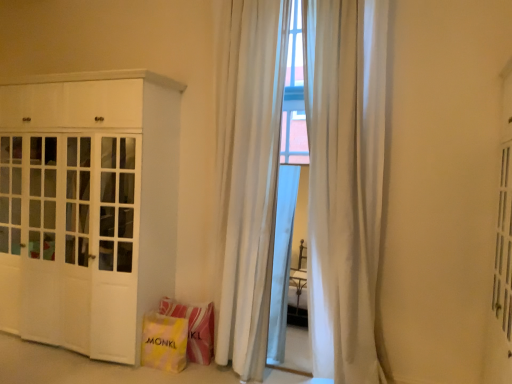
Question: From a real-world perspective, does yellow fabric shopping bag at lower left, positioned as the 2th shopping bag in back-to-front order, sit lower than yellow fabric shopping bag at lower center, which appears as the second shopping bag when viewed from the front?

Choices:
 (A) no
 (B) yes

Answer: (B)

Question: Is yellow fabric shopping bag at lower left, positioned as the 2th shopping bag in back-to-front order, positioned behind yellow fabric shopping bag at lower center, the 1th shopping bag from the back?

Choices:
 (A) yes
 (B) no

Answer: (B)

Question: From a real-world perspective, does yellow fabric shopping bag at lower left, positioned as the 2th shopping bag in back-to-front order, stand above yellow fabric shopping bag at lower center, which appears as the second shopping bag when viewed from the front?

Choices:
 (A) yes
 (B) no

Answer: (B)

Question: Can you confirm if yellow fabric shopping bag at lower left, positioned as the 2th shopping bag in back-to-front order, is taller than yellow fabric shopping bag at lower center, which appears as the second shopping bag when viewed from the front?

Choices:
 (A) no
 (B) yes

Answer: (A)

Question: Can yellow fabric shopping bag at lower center, which appears as the second shopping bag when viewed from the front, be found inside yellow fabric shopping bag at lower left, placed as the 1th shopping bag when sorted from front to back?

Choices:
 (A) yes
 (B) no

Answer: (B)

Question: From the image's perspective, relative to yellow fabric shopping bag at lower center, the 1th shopping bag from the back, is white matte cabinet at left above or below?

Choices:
 (A) below
 (B) above

Answer: (B)

Question: In the image, is white matte cabinet at left on the left side or the right side of yellow fabric shopping bag at lower center, the 1th shopping bag from the back?

Choices:
 (A) left
 (B) right

Answer: (A)

Question: Is point (75, 206) closer or farther from the camera than point (210, 306)?

Choices:
 (A) closer
 (B) farther

Answer: (B)

Question: Is white matte cabinet at left in front of or behind yellow fabric shopping bag at lower center, which appears as the second shopping bag when viewed from the front, in the image?

Choices:
 (A) behind
 (B) front

Answer: (B)

Question: In terms of width, does yellow fabric shopping bag at lower left, positioned as the 2th shopping bag in back-to-front order, look wider or thinner when compared to white matte cabinet at left?

Choices:
 (A) thin
 (B) wide

Answer: (A)

Question: In the image, is yellow fabric shopping bag at lower left, placed as the 1th shopping bag when sorted from front to back, on the left side or the right side of white matte cabinet at left?

Choices:
 (A) left
 (B) right

Answer: (B)

Question: From a real-world perspective, relative to white matte cabinet at left, is yellow fabric shopping bag at lower left, positioned as the 2th shopping bag in back-to-front order, vertically above or below?

Choices:
 (A) below
 (B) above

Answer: (A)

Question: Do you think yellow fabric shopping bag at lower left, positioned as the 2th shopping bag in back-to-front order, is within white matte cabinet at left, or outside of it?

Choices:
 (A) inside
 (B) outside

Answer: (B)

Question: Does point (189, 349) appear closer or farther from the camera than point (162, 332)?

Choices:
 (A) closer
 (B) farther

Answer: (B)

Question: From the image's perspective, relative to yellow fabric shopping bag at lower left, positioned as the 2th shopping bag in back-to-front order, is yellow fabric shopping bag at lower center, which appears as the second shopping bag when viewed from the front, above or below?

Choices:
 (A) above
 (B) below

Answer: (A)